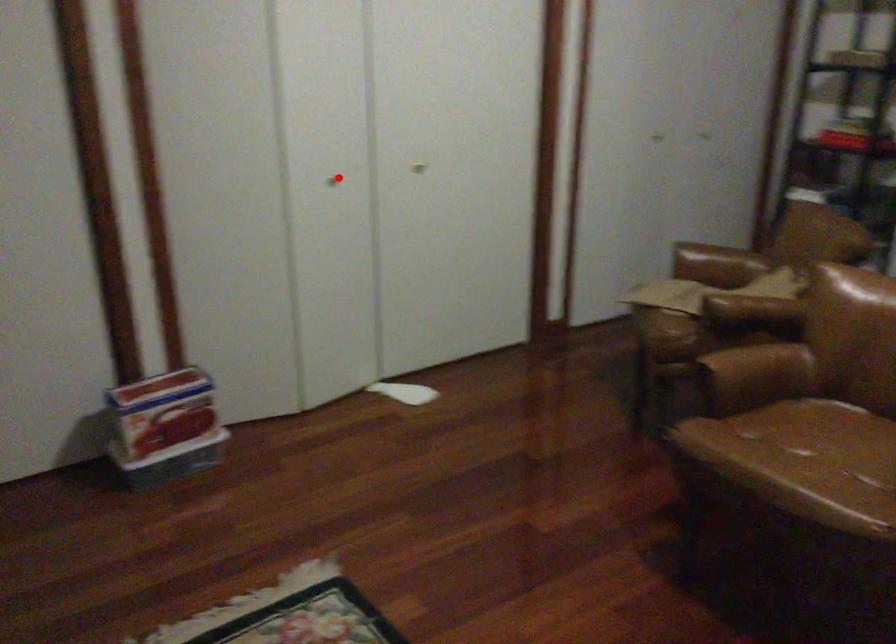
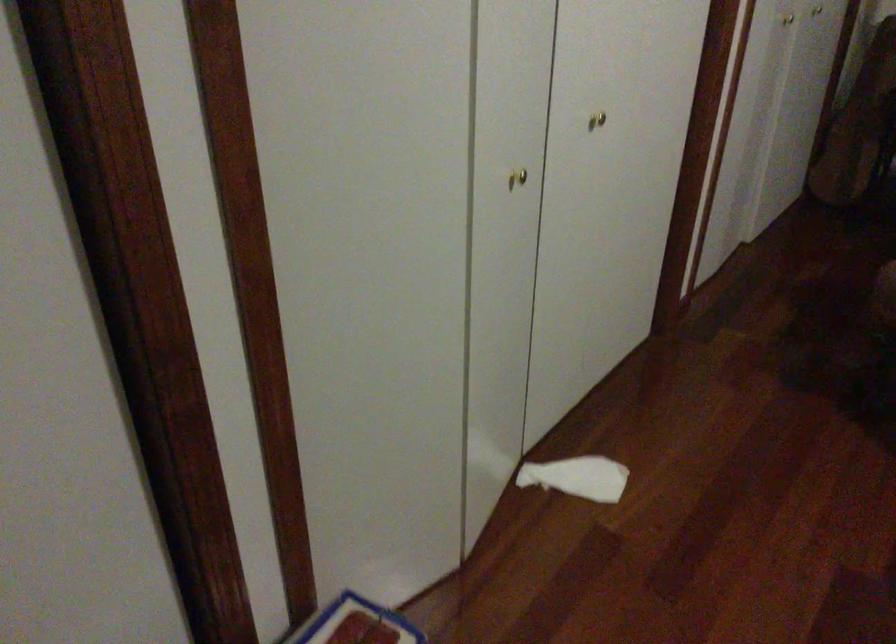
Question: I am providing you with two images of the same scene from different viewpoints. A red point is shown in image1. For the corresponding object point in image2, is it positioned nearer or farther from the camera?

Choices:
 (A) Nearer
 (B) Farther

Answer: (A)